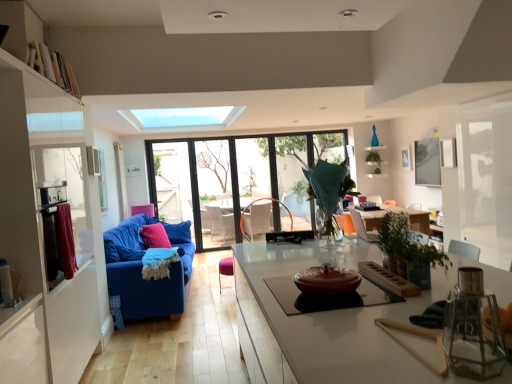
This screenshot has height=384, width=512. Describe the element at coordinates (261, 200) in the screenshot. I see `white fabric swivel chair at center` at that location.

Locate an element on the screen. Image resolution: width=512 pixels, height=384 pixels. white fabric swivel chair at center is located at coordinates (261, 200).

What do you see at coordinates (154, 236) in the screenshot? Image resolution: width=512 pixels, height=384 pixels. I see `pink fabric pillow at center` at bounding box center [154, 236].

What is the approximate height of pink fabric pillow at center?

The height of pink fabric pillow at center is 14.96 inches.

This screenshot has height=384, width=512. I want to click on green matte plant at upper center, which is the first plant in top-to-bottom order, so click(x=374, y=161).

The width and height of the screenshot is (512, 384). What do you see at coordinates (170, 181) in the screenshot?
I see `blue fabric couch at left` at bounding box center [170, 181].

What do you see at coordinates (377, 171) in the screenshot? This screenshot has height=384, width=512. I see `green leafy plant at center, which is the 3th plant from left to right` at bounding box center [377, 171].

In order to click on velvet pink armchair at center, the second armchair viewed from the left in this screenshot , I will do `click(362, 228)`.

This screenshot has width=512, height=384. Identify the location of white fabric swivel chair at center. (261, 200).

How many degrees apart are the facing directions of maroon fabric curtain at left and transparent glass window at center?

The angle between the facing direction of maroon fabric curtain at left and the facing direction of transparent glass window at center is 89.3 degrees.

Considering the points (61, 220) and (188, 194), which point is behind, point (61, 220) or point (188, 194)?

The point (188, 194) is farther.

Based on the photo, from a real-world perspective, is maroon fabric curtain at left on top of transparent glass window at center?

Yes.

From the image's perspective, is maroon fabric curtain at left located above or below transparent glass window at center?

maroon fabric curtain at left is below transparent glass window at center.

Which point is more distant from viewer, (59, 240) or (69, 92)?

The point (69, 92) is behind.

Based on the photo, is maroon fabric curtain at left placed right next to white wooden bookshelf at upper left?

There is a gap between maroon fabric curtain at left and white wooden bookshelf at upper left.

Considering the sizes of objects maroon fabric curtain at left and white wooden bookshelf at upper left in the image provided, who is shorter, maroon fabric curtain at left or white wooden bookshelf at upper left?

white wooden bookshelf at upper left is shorter.

How different are the orientations of blue fabric couch at left and transparent glass window at center in degrees?

88.1 degrees.

Is blue fabric couch at left aimed at transparent glass window at center?

No, blue fabric couch at left is not aimed at transparent glass window at center.

From a real-world perspective, which is physically above, blue fabric couch at left or transparent glass window at center?

In real-world perspective, transparent glass window at center is above.

Which point is more forward, (x=170, y=239) or (x=203, y=220)?

The point (x=170, y=239) is closer.

Is green leafy plant at center, which is the 3th plant from left to right, wider than green matte plant at upper center, which is the second plant from left to right?

No, green leafy plant at center, which is the 3th plant from left to right, is not wider than green matte plant at upper center, which is the second plant from left to right.

From a real-world perspective, does green leafy plant at center, which appears as the first plant when viewed from the back, sit lower than green matte plant at upper center, which is the second plant from left to right?

Yes, from a real-world perspective, green leafy plant at center, which appears as the first plant when viewed from the back, is below green matte plant at upper center, which is the second plant from left to right.

Is green leafy plant at center, which is the 3th plant from left to right, closer to the viewer compared to green matte plant at upper center, the second plant in the right-to-left sequence?

No.

Could green matte plant at upper center, which is the first plant in top-to-bottom order, be considered to be inside green leafy plant at center, which is the 1th plant from right to left?

Definitely not — green matte plant at upper center, which is the first plant in top-to-bottom order, is not inside green leafy plant at center, which is the 1th plant from right to left.

Is transparent glass window at center not near green leafy plant at center, which is the 3th plant from left to right?

That's right, there is a large distance between transparent glass window at center and green leafy plant at center, which is the 3th plant from left to right.

Which object is positioned more to the left, transparent glass window at center or green leafy plant at center, the second plant from the top?

transparent glass window at center is more to the left.

Considering the sizes of transparent glass window at center and green leafy plant at center, which is the 1th plant from right to left, in the image, is transparent glass window at center bigger or smaller than green leafy plant at center, which is the 1th plant from right to left,?

Clearly, transparent glass window at center is larger in size than green leafy plant at center, which is the 1th plant from right to left.

Which is more to the right, maroon fabric curtain at left or blue fabric couch at left?

From the viewer's perspective, maroon fabric curtain at left appears more on the right side.

Which of these two, maroon fabric curtain at left or blue fabric couch at left, is smaller?

maroon fabric curtain at left is smaller.

The image size is (512, 384). I want to click on studio couch below the maroon fabric curtain at left (from the image's perspective), so click(x=141, y=270).

Would you say maroon fabric curtain at left is inside or outside blue fabric couch at left?

maroon fabric curtain at left cannot be found inside blue fabric couch at left.

Identify the location of pillow that is in front of the green matte plant at upper center, which is the second plant from left to right. (154, 236).

Which of these two, green matte plant at upper center, which is the first plant in top-to-bottom order, or pink fabric pillow at center, is thinner?

With smaller width is pink fabric pillow at center.

How different are the orientations of green matte plant at upper center, arranged as the 2th plant when viewed from the back, and pink fabric pillow at center in degrees?

→ The angular difference between green matte plant at upper center, arranged as the 2th plant when viewed from the back, and pink fabric pillow at center is 60.7 degrees.

From a real-world perspective, which object rests below the other?

pink fabric pillow at center.

What are the coordinates of `window located underneath the maroon fabric curtain at left (from a real-world perspective)` in the screenshot? It's located at (234, 179).

In order to click on curtain behind the white wooden bookshelf at upper left in this screenshot , I will do `click(65, 241)`.

Considering their positions, is green matte plant at upper center, the third plant ordered from the bottom, positioned further to white wooden bookshelf at upper left than pink fabric pillow at center?

The object further to white wooden bookshelf at upper left is green matte plant at upper center, the third plant ordered from the bottom.

Which object lies nearer to the anchor point transparent glass window at center, white fabric swivel chair at center or maroon fabric curtain at left?

white fabric swivel chair at center lies closer to transparent glass window at center than the other object.

Considering their positions, is blue fabric couch at left positioned closer to green matte plant at upper center, which is the first plant in top-to-bottom order, than pink fabric armchair at left, which appears as the first armchair when viewed from the left?

Among the two, pink fabric armchair at left, which appears as the first armchair when viewed from the left, is located nearer to green matte plant at upper center, which is the first plant in top-to-bottom order.

Looking at the image, which one is located further to velvet pink armchair at center, the 2th armchair positioned from the back, white fabric swivel chair at center or green matte plant at upper center, the second plant in the right-to-left sequence?

white fabric swivel chair at center.

Looking at the image, which one is located closer to maroon fabric curtain at left, transparent glass window at center or blue fabric couch at left?

The object closer to maroon fabric curtain at left is blue fabric couch at left.

Which object lies nearer to the anchor point green matte plant at upper center, the second plant in the right-to-left sequence, maroon fabric curtain at left or velvet pink armchair at center, the 2th armchair positioned from the back?

Based on the image, velvet pink armchair at center, the 2th armchair positioned from the back, appears to be nearer to green matte plant at upper center, the second plant in the right-to-left sequence.

Which object lies further to the anchor point blue fabric couch at left, blue fabric couch at left or translucent glass vase at center, which appears as the first plant when viewed from the left?

translucent glass vase at center, which appears as the first plant when viewed from the left, is positioned further to the anchor blue fabric couch at left.

Which object lies nearer to the anchor point maroon fabric curtain at left, pink fabric pillow at center or green matte plant at upper center, which is the second plant from left to right?

pink fabric pillow at center.

Find the location of a particular element. studio couch positioned between white wooden bookshelf at upper left and white fabric swivel chair at center from near to far is located at coordinates (141, 270).

You are a GUI agent. You are given a task and a screenshot of the screen. Output one action in this format:
    pyautogui.click(x=<x>, y=<y>)
    Task: Click on the curtain positioned between white wooden bookshelf at upper left and green matte plant at upper center, arranged as the 2th plant when viewed from the back, from near to far
    
    Given the screenshot: What is the action you would take?
    pyautogui.click(x=65, y=241)

Identify the location of plant between translucent glass vase at center, positioned as the 3th plant in top-to-bottom order, and green leafy plant at center, which appears as the first plant when viewed from the back, in the front-back direction. This screenshot has width=512, height=384. (374, 161).

This screenshot has width=512, height=384. I want to click on armchair located between velvet pink armchair at center, the 2th armchair positioned from the back, and green matte plant at upper center, which is the first plant in top-to-bottom order, in the depth direction, so (143, 209).